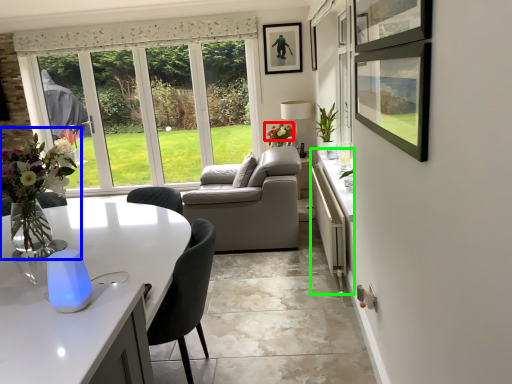
Question: Based on their relative distances, which object is nearer to flower (highlighted by a red box)? Choose from floral arrangement (highlighted by a blue box) and counter (highlighted by a green box).

Choices:
 (A) floral arrangement
 (B) counter

Answer: (B)